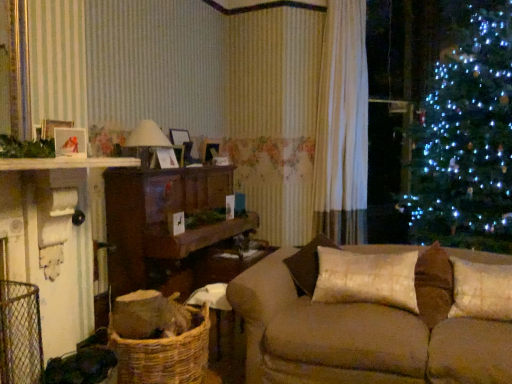
Question: Is brown fabric couch at center looking in the opposite direction of woven brown basket at lower left?

Choices:
 (A) no
 (B) yes

Answer: (A)

Question: Does brown fabric couch at center come in front of woven brown basket at lower left?

Choices:
 (A) no
 (B) yes

Answer: (B)

Question: Is brown fabric couch at center taller than woven brown basket at lower left?

Choices:
 (A) no
 (B) yes

Answer: (B)

Question: From the image's perspective, would you say brown fabric couch at center is positioned over woven brown basket at lower left?

Choices:
 (A) no
 (B) yes

Answer: (B)

Question: Does brown fabric couch at center appear on the left side of woven brown basket at lower left?

Choices:
 (A) yes
 (B) no

Answer: (B)

Question: Looking at their shapes, would you say white textured pillow at right, the first pillow viewed from the right, is wider or thinner than matte white picture frame at left?

Choices:
 (A) thin
 (B) wide

Answer: (B)

Question: Looking at the image, does white textured pillow at right, the first pillow viewed from the right, seem bigger or smaller compared to matte white picture frame at left?

Choices:
 (A) small
 (B) big

Answer: (B)

Question: Is point (508, 296) closer or farther from the camera than point (55, 152)?

Choices:
 (A) closer
 (B) farther

Answer: (B)

Question: From the image's perspective, is white textured pillow at right, positioned as the 2th pillow in left-to-right order, above or below matte white picture frame at left?

Choices:
 (A) below
 (B) above

Answer: (A)

Question: From a real-world perspective, relative to woven brown basket at lower left, is brown fabric couch at center vertically above or below?

Choices:
 (A) above
 (B) below

Answer: (A)

Question: Based on their sizes in the image, would you say brown fabric couch at center is bigger or smaller than woven brown basket at lower left?

Choices:
 (A) big
 (B) small

Answer: (A)

Question: Considering the positions of point (436, 299) and point (134, 357), is point (436, 299) closer or farther from the camera than point (134, 357)?

Choices:
 (A) closer
 (B) farther

Answer: (B)

Question: Choose the correct answer: Is brown fabric couch at center inside woven brown basket at lower left or outside it?

Choices:
 (A) inside
 (B) outside

Answer: (B)

Question: Considering the positions of matte white picture frame at left and white sheer curtain at center in the image, is matte white picture frame at left taller or shorter than white sheer curtain at center?

Choices:
 (A) tall
 (B) short

Answer: (B)

Question: In terms of size, does matte white picture frame at left appear bigger or smaller than white sheer curtain at center?

Choices:
 (A) small
 (B) big

Answer: (A)